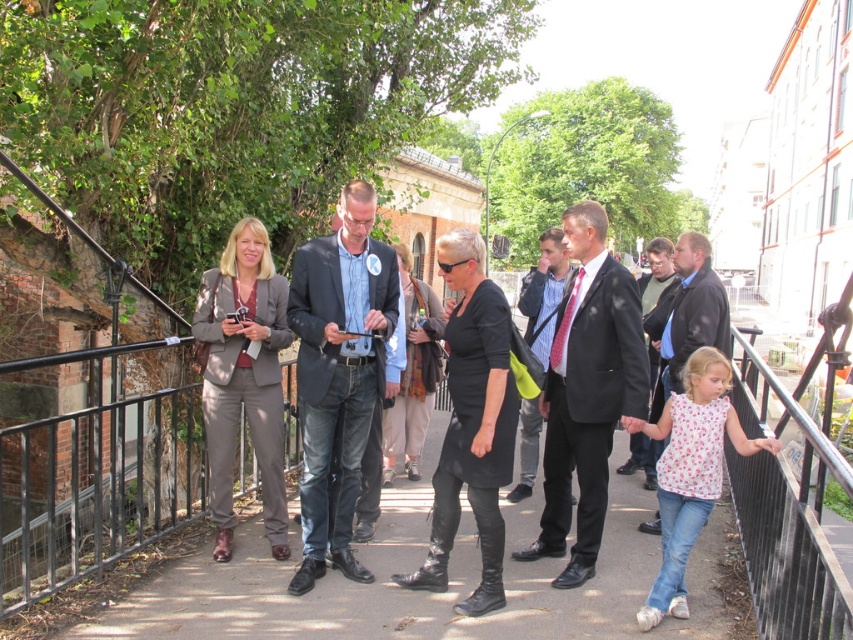
You are organizing a photo shoot and need to position two models based on their clothing. The dark blue suit at center and the white floral blouse at lower right must be placed according to their original positions. Which clothing item is located to the left of the other?

The dark blue suit at center is positioned on the left side of white floral blouse at lower right.

Consider the image. You are standing on the bridge and want to approach the black suit at center to ask a question. If you can walk 3 feet per second, how many seconds will it take you to reach them?

The distance between you and the black suit at center is 12.42 feet. At a walking speed of 3 feet per second, it would take approximately 4.14 seconds to reach them.